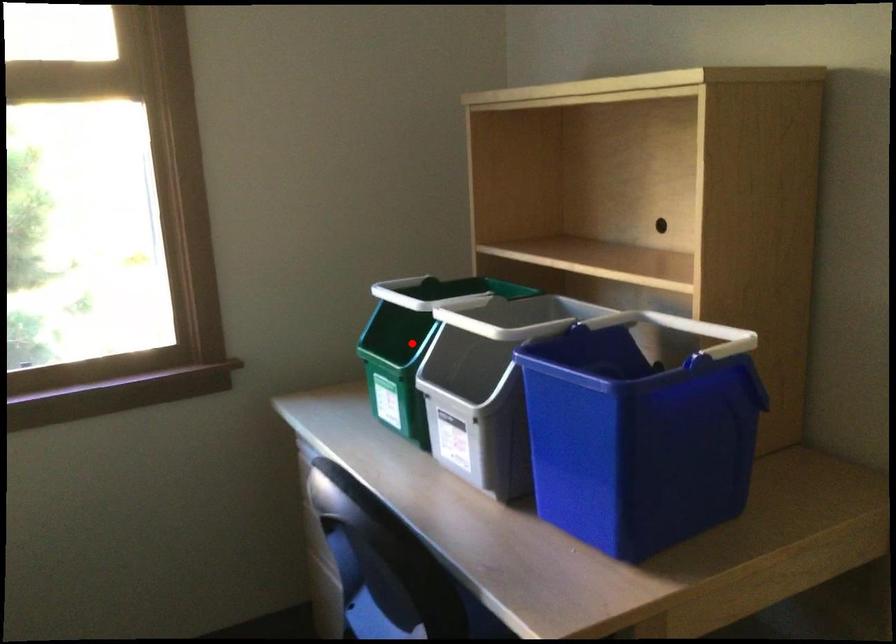
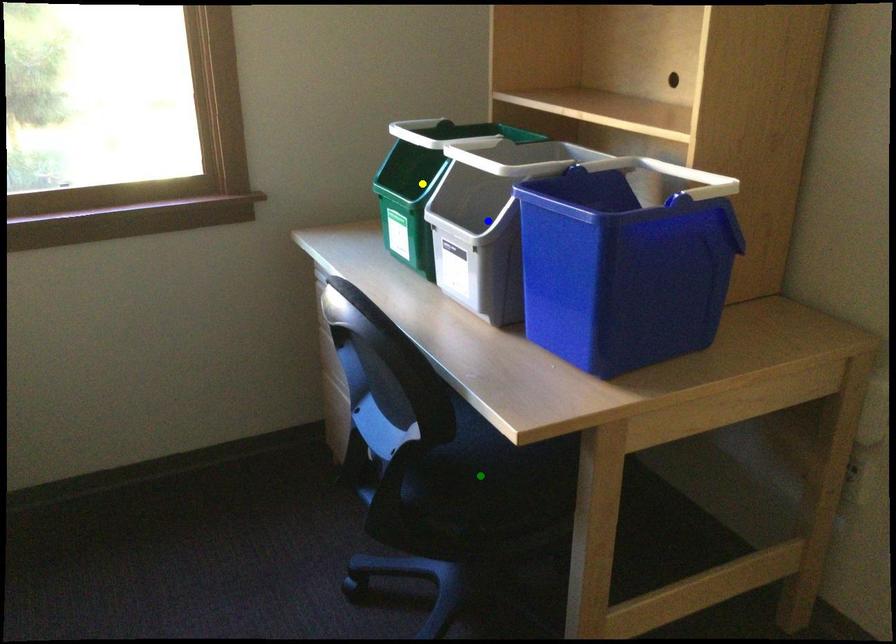
Question: I am providing you with two images of the same scene from different viewpoints. A red point is marked on the first image. You are given multiple points on the second image. Can you choose the point in image 2 that corresponds to the point in image 1?

Choices:
 (A) green point
 (B) yellow point
 (C) blue point

Answer: (B)